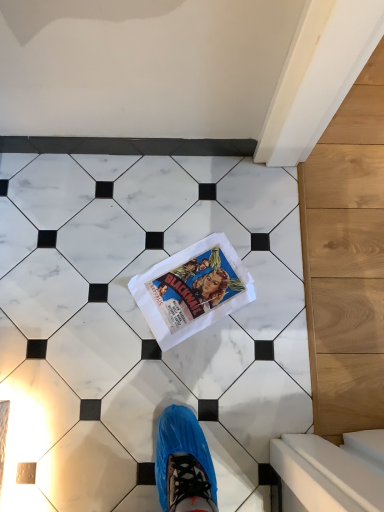
What do you see at coordinates (192, 289) in the screenshot?
I see `white paper comic book at center` at bounding box center [192, 289].

Locate an element on the screen. The width and height of the screenshot is (384, 512). white paper comic book at center is located at coordinates (192, 289).

At what (x,y) coordinates should I click in order to perform the action: click on white paper comic book at center. Please return your answer as a coordinate pair (x, y). The width and height of the screenshot is (384, 512). Looking at the image, I should click on (192, 289).